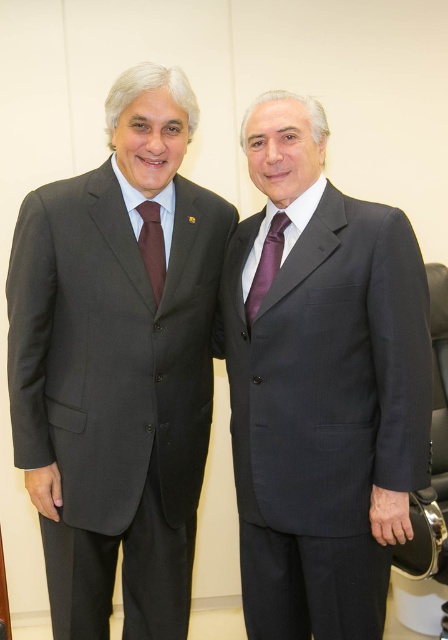
In the scene shown: Is matte black suit at left taller than purple satin tie at center?

Yes, matte black suit at left is taller than purple satin tie at center.

Is point (112, 196) in front of point (274, 257)?

Yes, it is.

At what (x,y) coordinates should I click in order to perform the action: click on matte black suit at left. Please return your answer as a coordinate pair (x, y). This screenshot has height=640, width=448. Looking at the image, I should click on (112, 369).

This screenshot has width=448, height=640. What do you see at coordinates (321, 385) in the screenshot?
I see `dark gray suit at center` at bounding box center [321, 385].

Locate an element on the screen. The image size is (448, 640). dark gray suit at center is located at coordinates (321, 385).

Does dark gray suit at center appear under brown silk tie at left?

Indeed, dark gray suit at center is positioned under brown silk tie at left.

Who is more forward, (423, 320) or (159, 232)?

Point (423, 320) is more forward.

Identify the location of dark gray suit at center. (321, 385).